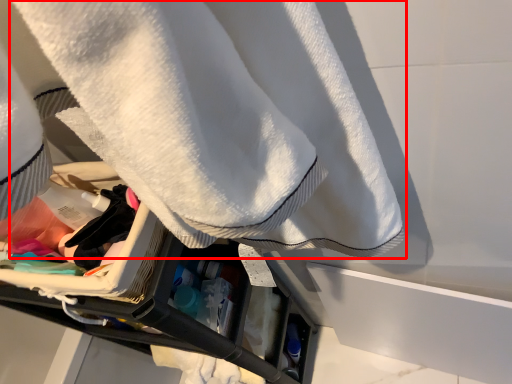
Question: From the image's perspective, where is towel (annotated by the red box) located in relation to clothing in the image?

Choices:
 (A) above
 (B) below

Answer: (A)